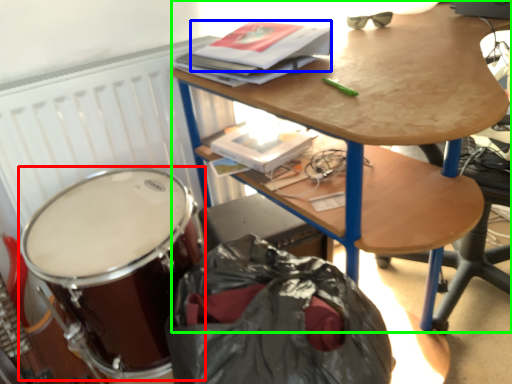
Question: Which object is the farthest from drum (highlighted by a red box)? Choose among these: paperback book (highlighted by a blue box) or desk (highlighted by a green box).

Choices:
 (A) paperback book
 (B) desk

Answer: (A)